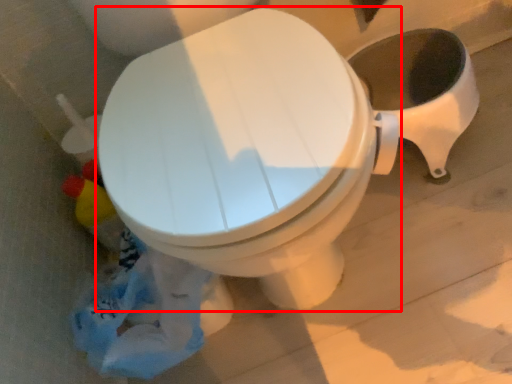
Question: Where is toilet (annotated by the red box) located in relation to garbage in the image?

Choices:
 (A) right
 (B) left

Answer: (A)